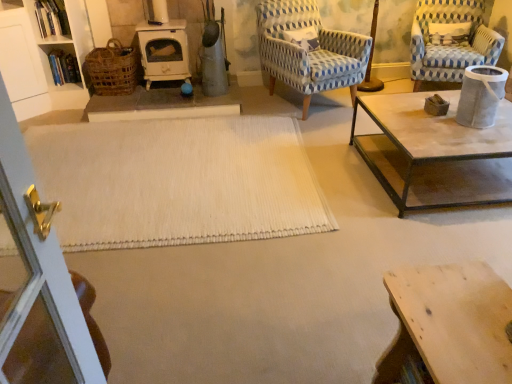
Identify the location of free spot above wooden table at lower right (from a real-world perspective). This screenshot has height=384, width=512. (458, 307).